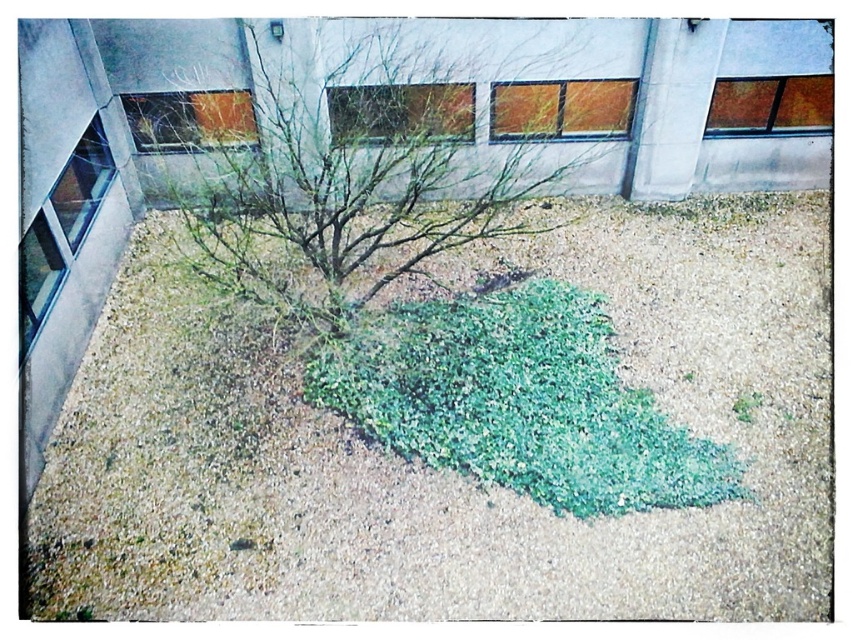
Question: Which object is closer to the camera taking this photo?

Choices:
 (A) bare branches at center
 (B) gray gravel at center

Answer: (B)

Question: Can you confirm if gray gravel at center is positioned below bare branches at center?

Choices:
 (A) no
 (B) yes

Answer: (B)

Question: Does gray gravel at center appear over bare branches at center?

Choices:
 (A) yes
 (B) no

Answer: (B)

Question: Considering the relative positions of gray gravel at center and bare branches at center in the image provided, where is gray gravel at center located with respect to bare branches at center?

Choices:
 (A) below
 (B) above

Answer: (A)